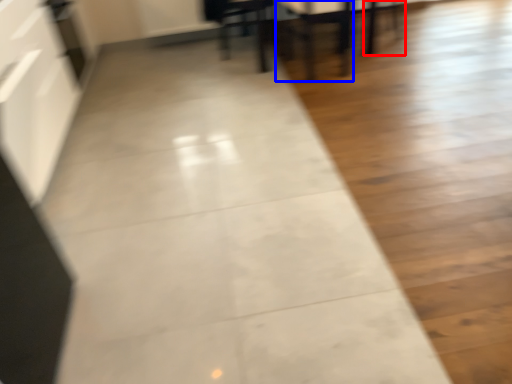
Question: Which of the following is the farthest to the observer, chair (highlighted by a red box) or armchair (highlighted by a blue box)?

Choices:
 (A) chair
 (B) armchair

Answer: (A)